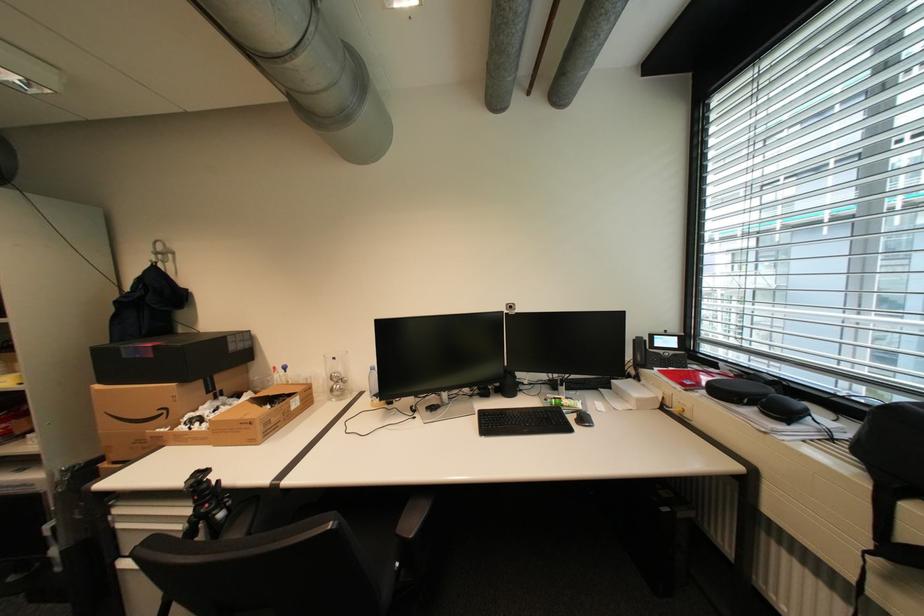
Where is `black chair armrest`? black chair armrest is located at coordinates (424, 522).